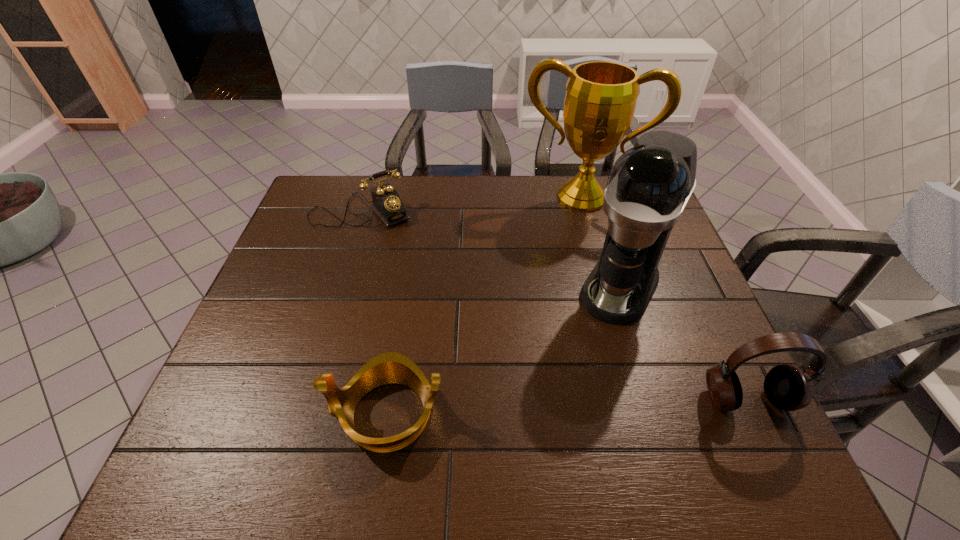
Where is `vacant area that lies between the award and the telephone`? This screenshot has height=540, width=960. vacant area that lies between the award and the telephone is located at coordinates (471, 204).

Where is `vacant space that's between the award and the tiara`? The image size is (960, 540). vacant space that's between the award and the tiara is located at coordinates (484, 306).

The height and width of the screenshot is (540, 960). What are the coordinates of `free spot between the tiara and the award` in the screenshot? It's located at (484, 306).

You are a GUI agent. You are given a task and a screenshot of the screen. Output one action in this format:
    pyautogui.click(x=<x>, y=<y>)
    Task: Click on the free point between the tiara and the coffee maker
    The image size is (960, 540).
    Given the screenshot: What is the action you would take?
    pyautogui.click(x=503, y=350)

Where is `object that is the second nearest to the award`? The image size is (960, 540). object that is the second nearest to the award is located at coordinates (387, 204).

Select which object is the fourth closest to the headset. Please provide its 2D coordinates. Your answer should be formatted as a tuple, i.e. [(x, y)], where the tuple contains the x and y coordinates of a point satisfying the conditions above.

[(387, 204)]

The image size is (960, 540). What are the coordinates of `vacant region that satisfies the following two spatial constraints: 1. on the front side of the third nearest object; 2. on the right side of the award` in the screenshot? It's located at (607, 287).